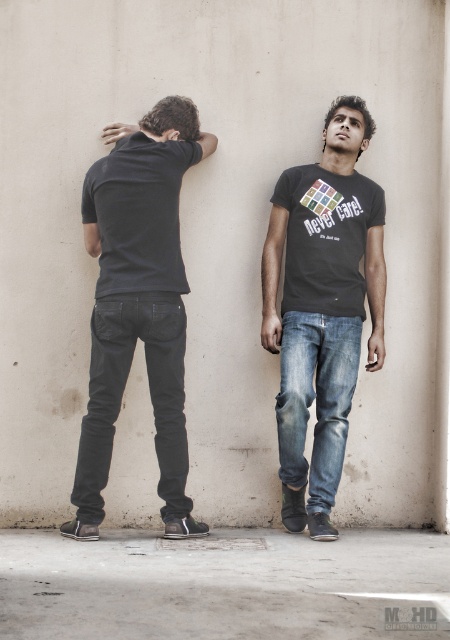
Question: Estimate the real-world distances between objects in this image. Which object is closer to the denim jeans at center?

Choices:
 (A) matte black t-shirt at left
 (B) dark gray matte t-shirt at center
 (C) matte black polo at back

Answer: (B)

Question: Which of the following is the closest to the observer?

Choices:
 (A) pyautogui.click(x=99, y=454)
 (B) pyautogui.click(x=346, y=294)
 (C) pyautogui.click(x=287, y=356)
 (D) pyautogui.click(x=265, y=259)

Answer: (A)

Question: Which of the following is the closest to the observer?

Choices:
 (A) black matte t-shirt at center
 (B) black denim jeans at back
 (C) denim jeans at center
 (D) matte black polo at back

Answer: (B)

Question: Is the position of matte black polo at back less distant than that of denim jeans at center?

Choices:
 (A) yes
 (B) no

Answer: (A)

Question: Can you confirm if black denim jeans at back is positioned below matte black polo at back?

Choices:
 (A) no
 (B) yes

Answer: (B)

Question: Does black denim jeans at back have a smaller size compared to denim jeans at center?

Choices:
 (A) no
 (B) yes

Answer: (B)